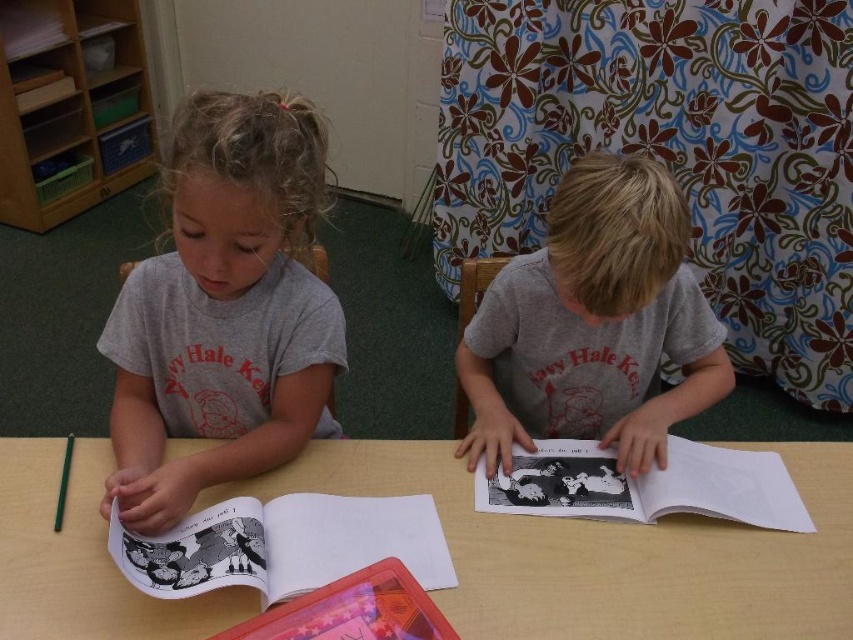
You are a photographer trying to capture a closeup of the gray matte shirt at left. What are the coordinates where you should focus your camera?

The gray matte shirt at left is located at coordinates point (224, 310), so you should focus your camera there.

You are a photographer trying to capture a closeup of the black paper book at center without including the gray matte shirt at center in the frame. Is this possible given their current positions?

The gray matte shirt at center is positioned over black paper book at center, so it would block the view of the book. Therefore, it is not possible to capture a closeup of the black paper book at center without including the gray matte shirt at center in the frame.

You are a teacher observing the classroom scene. You need to ensure that the students are maintaining a safe distance of at least 20 inches between themselves and shared materials. Are the gray matte shirt at left and black paper book at center within the required distance?

The gray matte shirt at left and black paper book at center are 17.84 inches apart, which is less than the required 20 inches. Therefore, they are too close and do not meet the safety distance requirement.